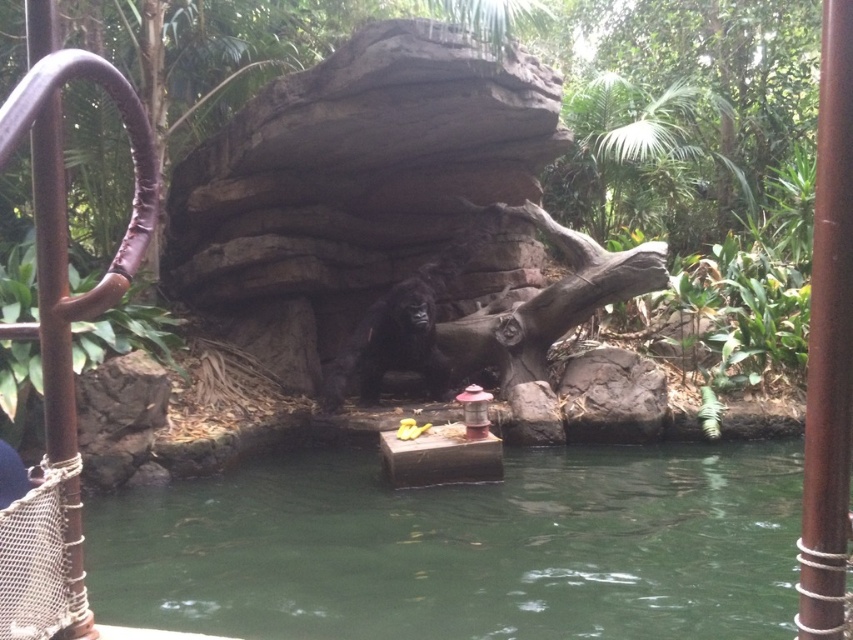
You are a zookeeper who needs to place a food bowl for the dark brown fur gorilla at center. The bowl requires a stable surface within 3 meters of the gorilla. Can the green water at center be used as a suitable location for placing the bowl?

The distance between the green water at center and the dark brown fur gorilla at center is 2.68 meters, which is within the 3 meters requirement. However, the green water at center is a body of water, so placing the food bowl there would not be stable. Therefore, the green water at center is not a suitable location for placing the food bowl.

You are a zookeeper who wants to ensure the safety of the dark brown fur gorilla at center. You notice the brown leather rail at left. Based on their sizes, do you think the gorilla could potentially squeeze through the rail? Please explain your reasoning.

The brown leather rail at left is narrower than the dark brown fur gorilla at center. Since the rail is narrower than the gorilla, the gorilla would not be able to squeeze through the rail as it is smaller than the animal.

You are a zookeeper planning to place a new feeding station. You need to ensure it is placed between the green water at center and the dark brown fur gorilla at center. Which side of the gorilla should you place it on?

The green water at center is to the left of the dark brown fur gorilla at center, so the feeding station should be placed to the left side of the gorilla.